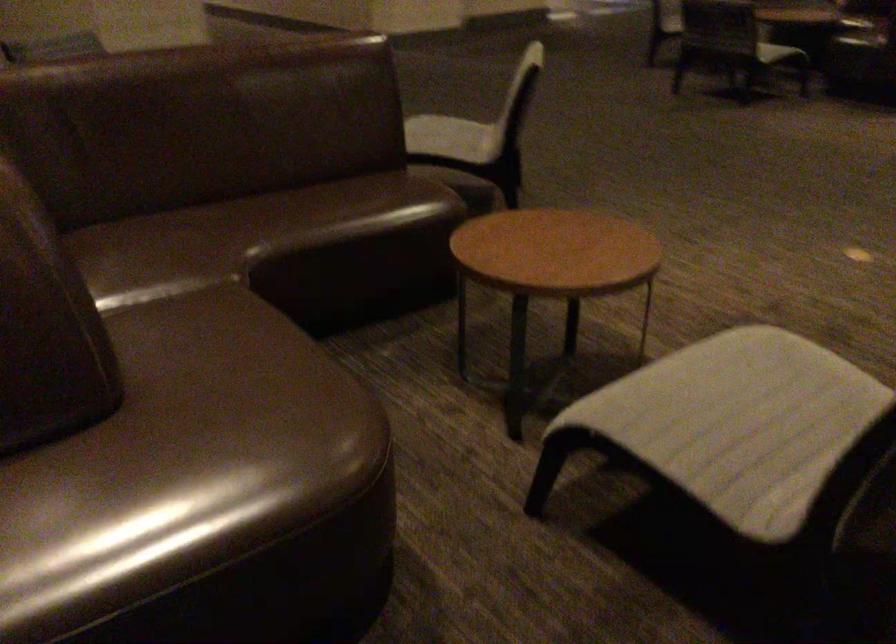
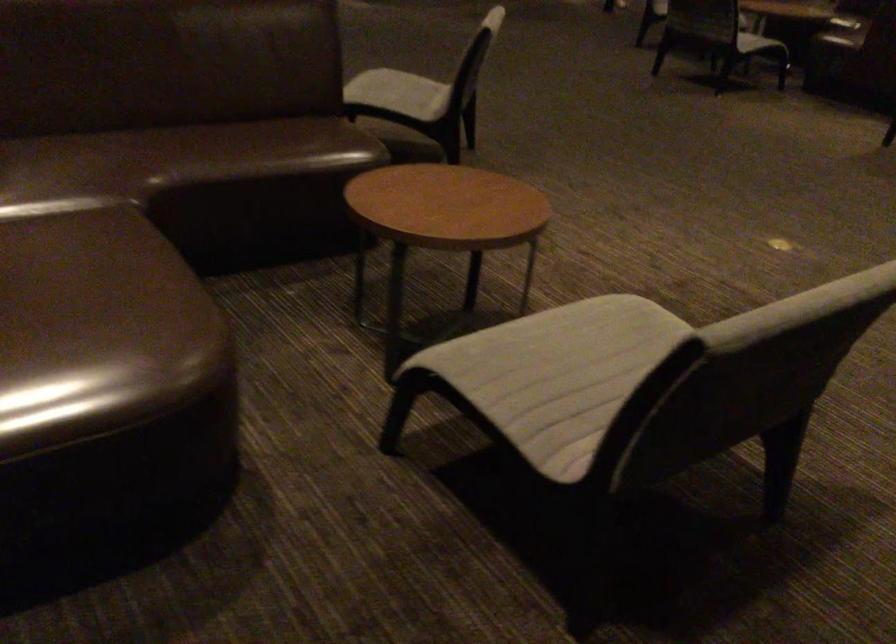
Question: Based on the continuous images, in which direction is the camera rotating? Reply with the corresponding letter.

Choices:
 (A) Left
 (B) Right
 (C) Up
 (D) Down

Answer: (D)